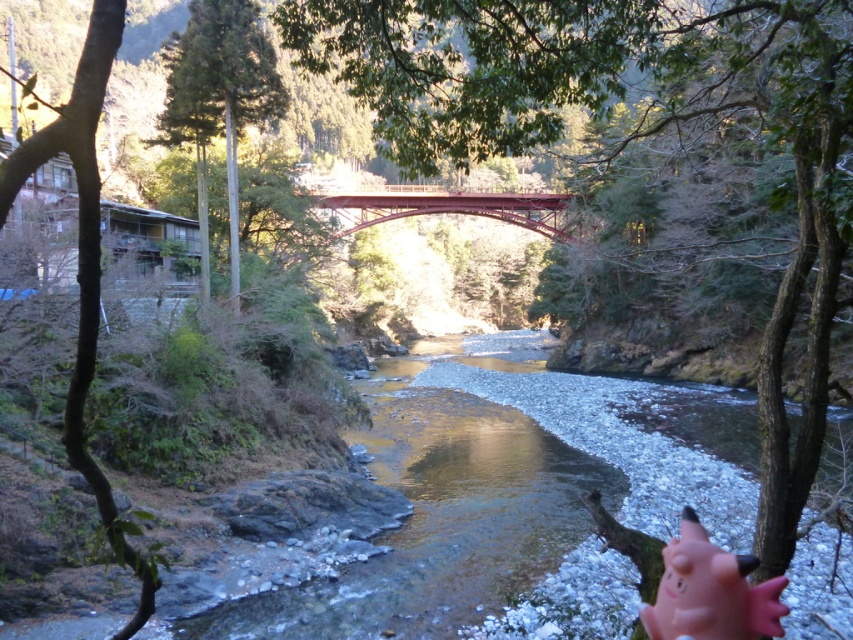
Question: Does clear water at center have a greater width compared to metallic bridge at center?

Choices:
 (A) no
 (B) yes

Answer: (B)

Question: Estimate the real-world distances between objects in this image. Which object is closer to the clear water at center?

Choices:
 (A) metallic bridge at center
 (B) pink rubber pig at lower right

Answer: (A)

Question: Is clear water at center smaller than metallic bridge at center?

Choices:
 (A) yes
 (B) no

Answer: (A)

Question: Is pink rubber pig at lower right positioned at the back of metallic bridge at center?

Choices:
 (A) yes
 (B) no

Answer: (B)

Question: Which point is farther from the camera taking this photo?

Choices:
 (A) (695, 529)
 (B) (294, 589)

Answer: (B)

Question: Considering the real-world distances, which object is closest to the metallic bridge at center?

Choices:
 (A) pink rubber pig at lower right
 (B) clear water at center

Answer: (B)